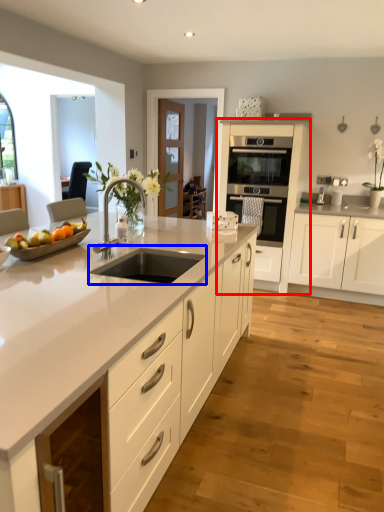
Question: Which of the following is the farthest to the observer, cabinetry (highlighted by a red box) or sink (highlighted by a blue box)?

Choices:
 (A) cabinetry
 (B) sink

Answer: (A)